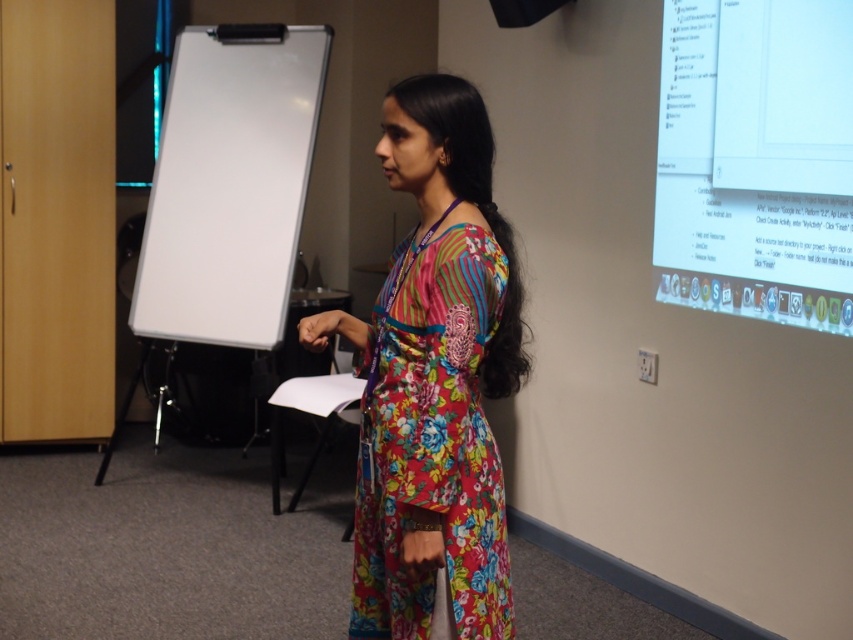
You are sitting in the audience and want to focus on the point that is closer to you. Which point should you look at between the point at coordinates [447,328] and the point at coordinates [746,253]?

You should look at the point at coordinates [447,328] because it is closer to you than the point at coordinates [746,253].

From the picture: You are attending a conference and need to present your slides. The floral fabric dress at center is blocking your view of the white glossy screen at upper right. Can you move around them to see the screen clearly?

The floral fabric dress at center is closer to the viewer than the white glossy screen at upper right. Therefore, moving around the person wearing the floral fabric dress at center would allow you to see the white glossy screen at upper right clearly.